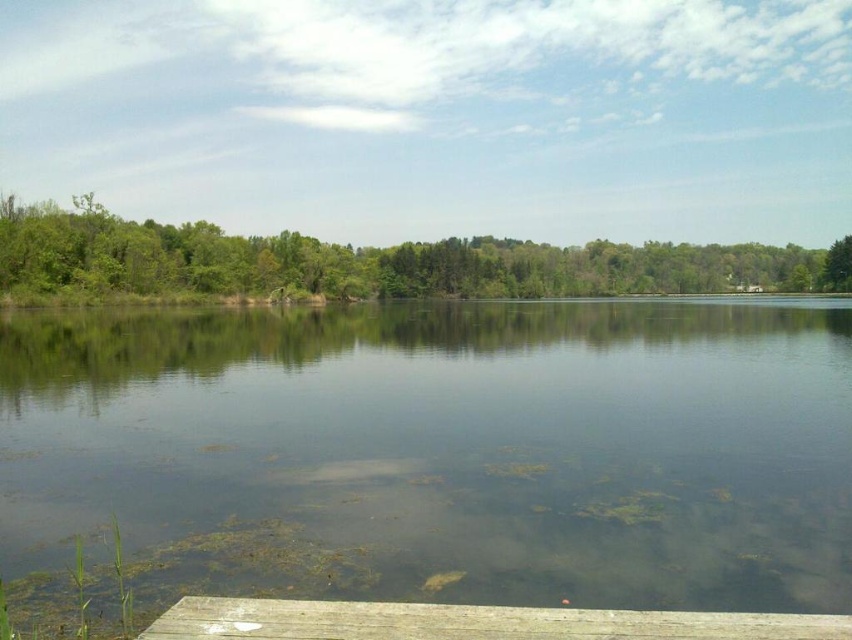
Is green leafy tree at left above wooden dock at lower center?

Indeed, green leafy tree at left is positioned over wooden dock at lower center.

Is green leafy tree at left taller than wooden dock at lower center?

Yes, green leafy tree at left is taller than wooden dock at lower center.

Locate an element on the screen. The image size is (852, 640). green leafy tree at left is located at coordinates (370, 262).

Who is positioned more to the left, clear water at center or green leafy tree at left?

Positioned to the left is clear water at center.

Who is taller, clear water at center or green leafy tree at left?

Standing taller between the two is green leafy tree at left.

Is point (366, 465) closer to camera compared to point (721, 288)?

Yes.

In order to click on clear water at center in this screenshot , I will do `click(436, 451)`.

Can you confirm if clear water at center is positioned above wooden dock at lower center?

Yes.

Which of these two, clear water at center or wooden dock at lower center, stands shorter?

Standing shorter between the two is wooden dock at lower center.

Locate an element on the screen. Image resolution: width=852 pixels, height=640 pixels. clear water at center is located at coordinates (436, 451).